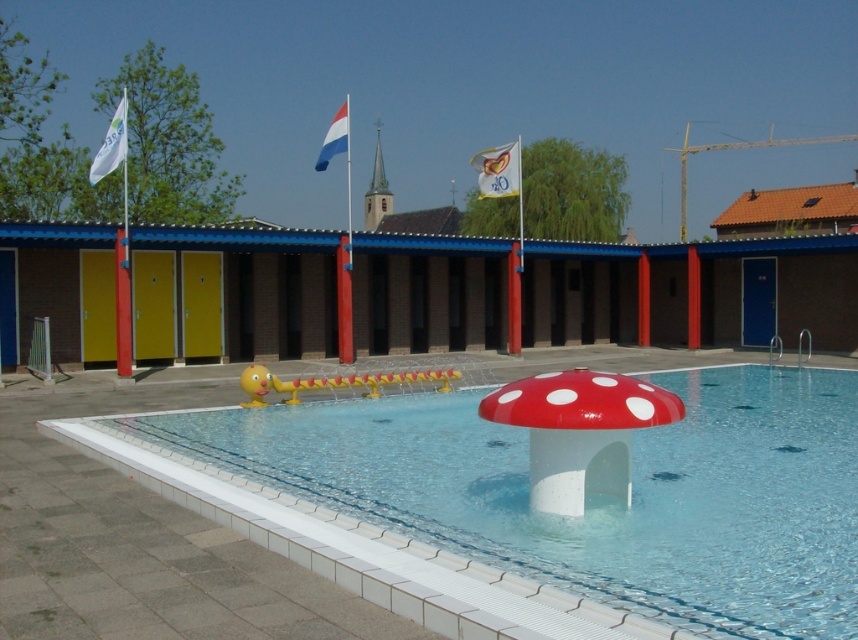
You are standing at the edge of the pool and want to determine which of the two points, point (421, 412) or point (343, 131), is closer to you. Based on the scene, which point is nearer?

Point (421, 412) is closer to the viewer than point (343, 131).